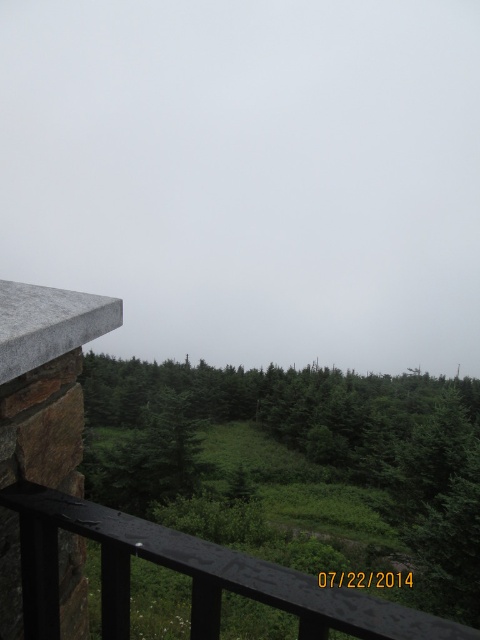
In the scene shown: Is green matte tree at center positioned behind black wood rail at lower left?

Yes, green matte tree at center is behind black wood rail at lower left.

Is green matte tree at center shorter than black wood rail at lower left?

In fact, green matte tree at center may be taller than black wood rail at lower left.

Image resolution: width=480 pixels, height=640 pixels. Find the location of `green matte tree at center`. green matte tree at center is located at coordinates tap(317, 454).